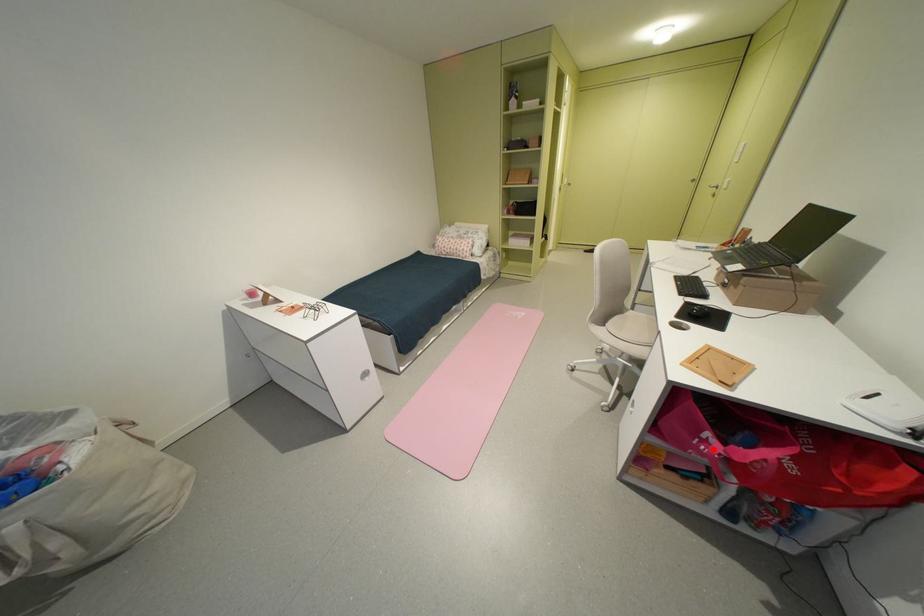
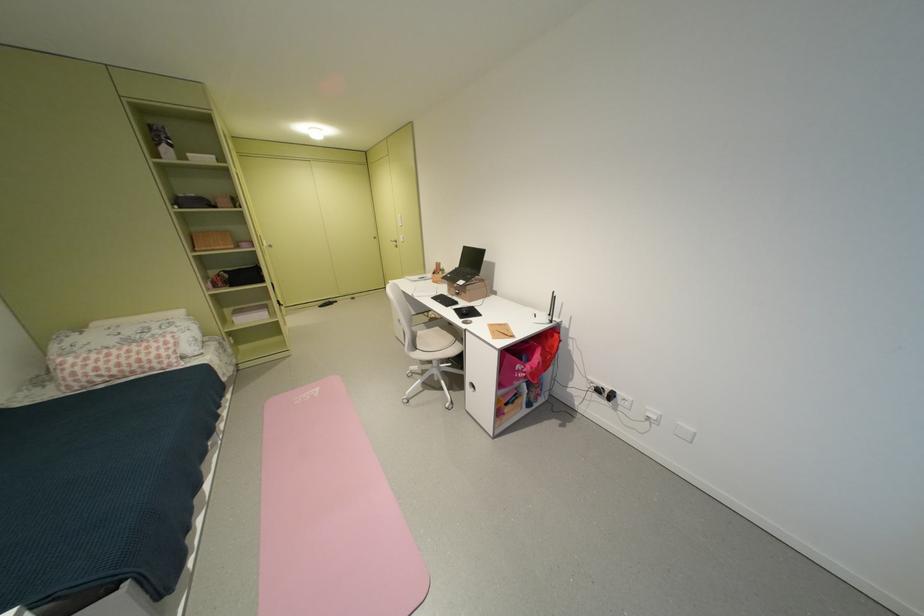
Question: I am providing you with two images of the same scene from different viewpoints. Image1 has a red point marked. In image2, the corresponding 3D location appears at what relative position? Reply with the corresponding letter.

Choices:
 (A) Closer
 (B) Farther

Answer: (B)